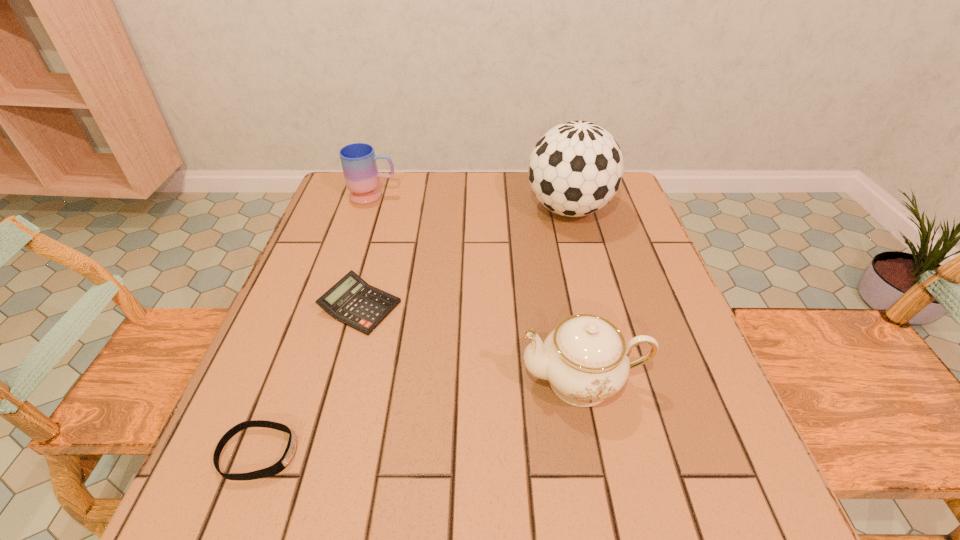
This screenshot has width=960, height=540. In order to click on the tallest object in this screenshot , I will do `click(576, 168)`.

Identify the location of the fourth farthest object. The image size is (960, 540). (585, 358).

You are a GUI agent. You are given a task and a screenshot of the screen. Output one action in this format:
    pyautogui.click(x=<x>, y=<y>)
    Task: Click on the mug
    The width and height of the screenshot is (960, 540).
    Given the screenshot: What is the action you would take?
    click(x=358, y=160)

At what (x,y) coordinates should I click in order to perform the action: click on calculator. Please return your answer as a coordinate pair (x, y). Looking at the image, I should click on (352, 301).

I want to click on the third nearest object, so click(x=352, y=301).

At what (x,y) coordinates should I click in order to perform the action: click on the nearest object. Please return your answer as a coordinate pair (x, y). Image resolution: width=960 pixels, height=540 pixels. Looking at the image, I should click on (289, 452).

I want to click on the shortest object, so click(289, 452).

At what (x,y) coordinates should I click in order to perform the action: click on vacant space located 0.060m on the left of the soccer ball. Please return your answer as a coordinate pair (x, y). This screenshot has height=540, width=960. Looking at the image, I should click on (504, 209).

This screenshot has height=540, width=960. What are the coordinates of `vacant space located 0.290m at the spout of the chinaware` in the screenshot? It's located at (362, 381).

The height and width of the screenshot is (540, 960). Identify the location of vacant space located at the spout of the chinaware. (427, 381).